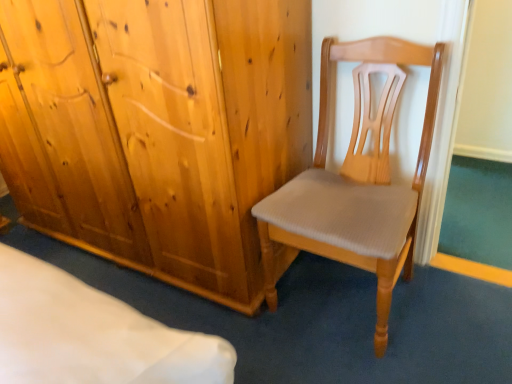
Identify the location of free spot below light brown wood chair at center (from a real-world perspective). The width and height of the screenshot is (512, 384). (335, 300).